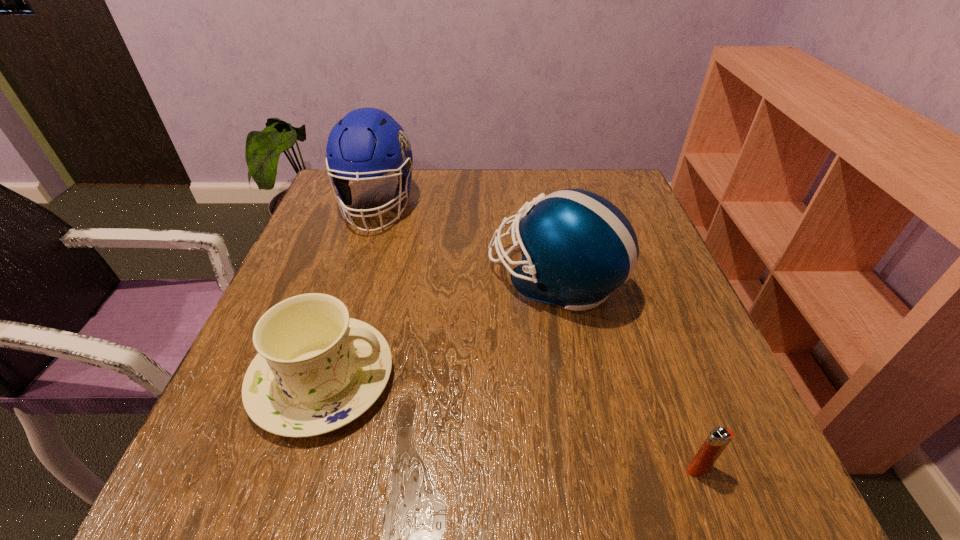
At what (x,y) coordinates should I click in order to perform the action: click on free location that satisfies the following two spatial constraints: 1. at the front of the shortest object with the faceguard; 2. on the left side of the nearer football helmet. Please return your answer as a coordinate pair (x, y). The height and width of the screenshot is (540, 960). Looking at the image, I should click on (589, 469).

The height and width of the screenshot is (540, 960). I want to click on vacant space that satisfies the following two spatial constraints: 1. on the handle side of the third farthest object; 2. on the right side of the nearest object, so click(x=294, y=469).

This screenshot has height=540, width=960. Identify the location of free space that satisfies the following two spatial constraints: 1. at the front of the second object from right to left with the faceguard; 2. on the left side of the igniter. (589, 469).

Find the location of a particular element. The width and height of the screenshot is (960, 540). blank space that satisfies the following two spatial constraints: 1. on the front-facing side of the shortest object; 2. on the right side of the farthest object is located at coordinates (294, 469).